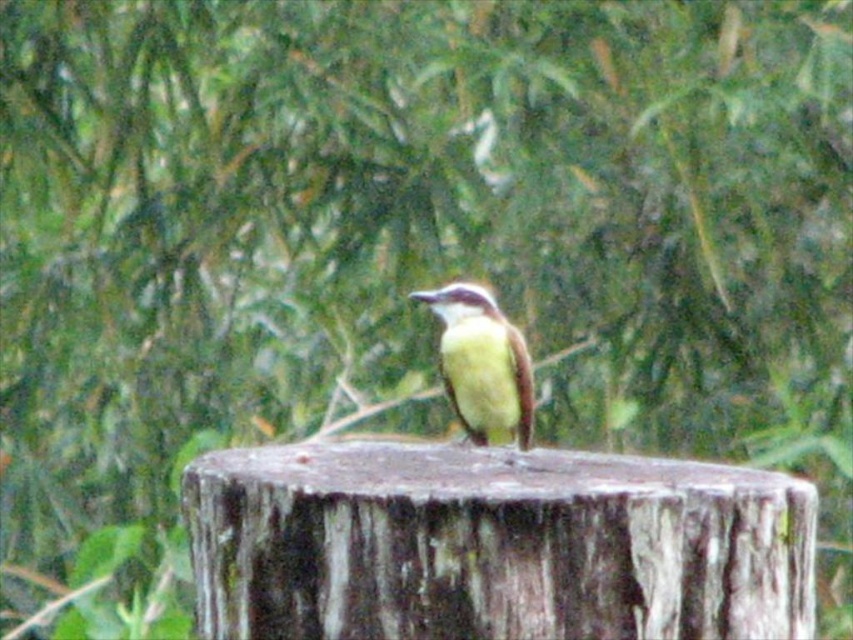
You are a photographer aiming to capture the yellow matte bird at center perched on the rough bark stump at center. Based on the scene description, can you confirm if the bird is indeed sitting on the stump?

Yes, the rough bark stump at center is positioned under the yellow matte bird at center, indicating that the bird is sitting on the stump.

You are a birdwatcher standing at a distance. You want to observe the bird perched on the rough bark stump at center without disturbing it. If your binoculars have a minimum focusing distance of 5 feet, will you be able to clearly see the bird through them?

The rough bark stump at center is 5.46 feet away from the viewer. Since the binoculars require a minimum focusing distance of 5 feet, the distance of 5.46 feet is sufficient for clear viewing. Therefore, you can observe the bird clearly without disturbing it.

Consider the image. You are a photographer trying to capture the yellow matte bird at center. You notice the rough bark stump at center is blocking part of the bird. Can you move closer to the bird to get a better shot without the stump obstructing it?

The rough bark stump at center is closer to the viewer than the yellow matte bird at center, so moving closer to the bird might not resolve the obstruction since the stump is already in front of the bird.